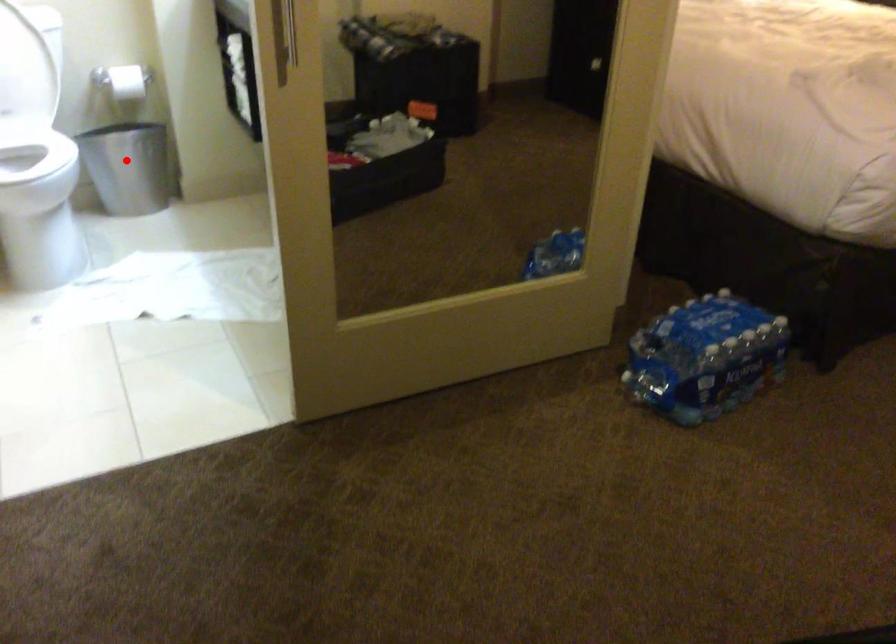
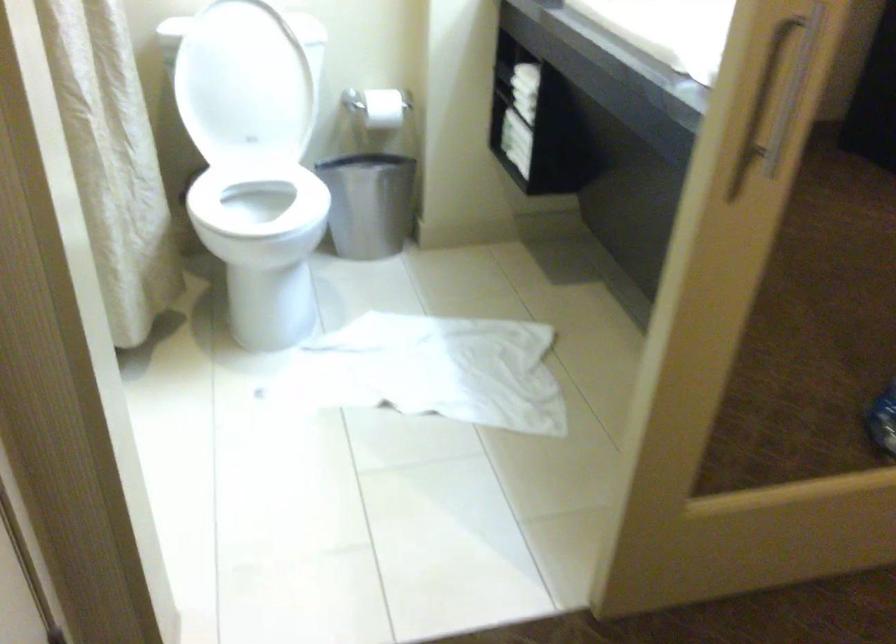
Find the pixel in the second image that matches the highlighted location in the first image.

(367, 204)